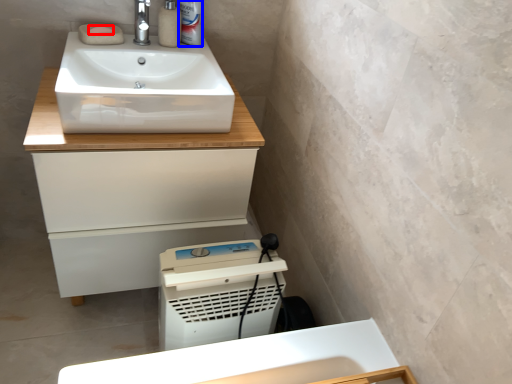
Question: Which point is further to the camera, soap (highlighted by a red box) or toiletry (highlighted by a blue box)?

Choices:
 (A) soap
 (B) toiletry

Answer: (B)